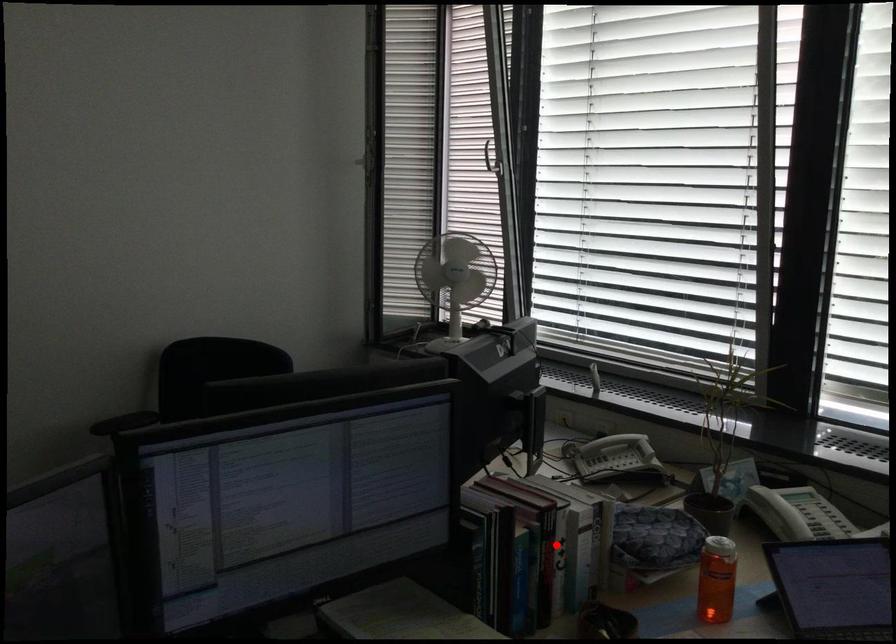
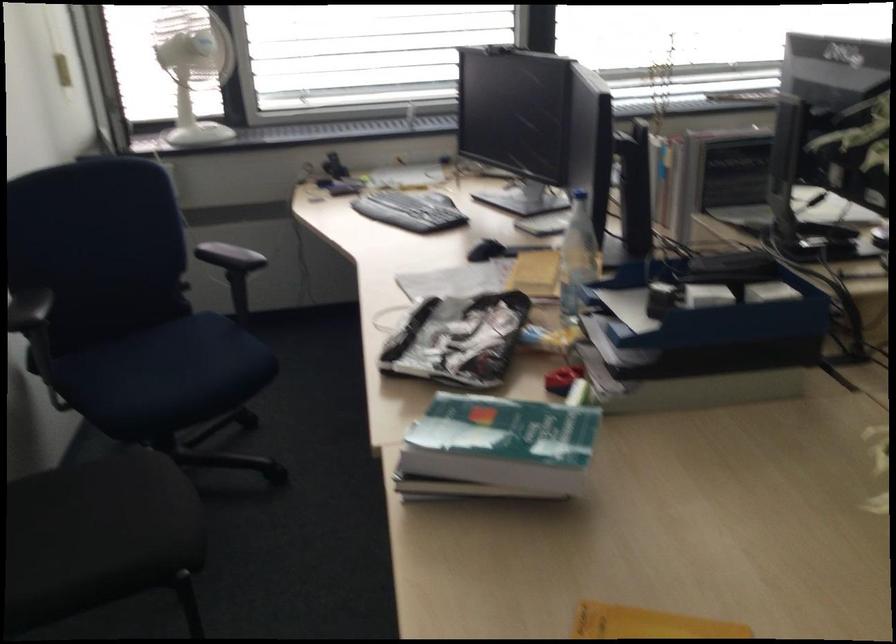
Question: I am providing you with two images of the same scene from different viewpoints. A red point is marked on the first image. At the location where the point appears in image 1, is it still visible in image 2?

Choices:
 (A) Yes
 (B) No

Answer: (B)